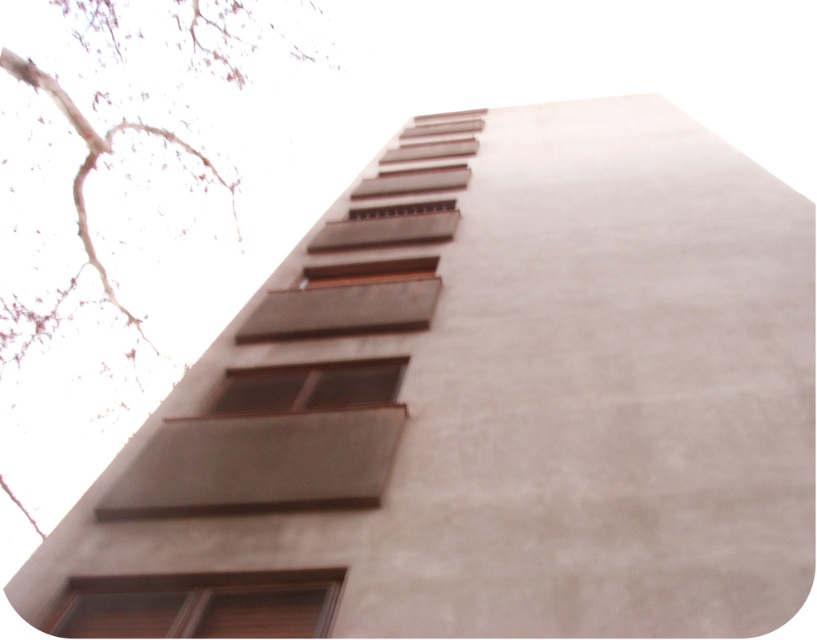
You are standing at the base of the building shown in the image. Looking up, you notice the brown wood tree at upper left. Based on its 2D coordinates, what is the tree positioned relative to the center of the wall?

The brown wood tree at upper left is positioned at coordinates 0.256 on the x axis and 0.144 on the y axis, which places it in the upper left quadrant relative to the center of the wall.

You are an architect reviewing the building facade. You notice the brown wooden window at lower left and the brown matte window at center. Which window has a greater height?

The brown matte window at center is taller than the brown wooden window at lower left, so it has a greater height.